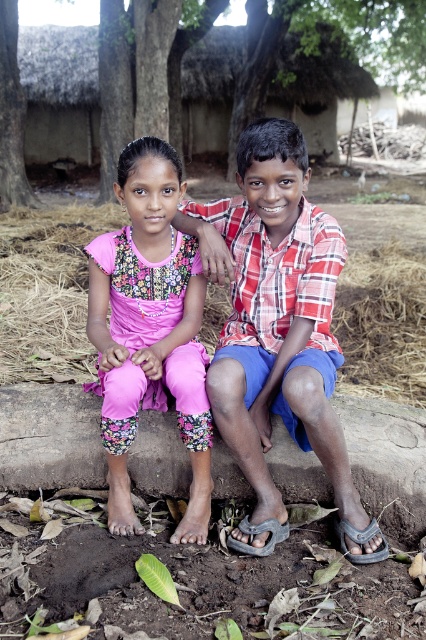
Question: Is red checkered shirt at center to the left of brown rough tree trunk at upper left from the viewer's perspective?

Choices:
 (A) no
 (B) yes

Answer: (A)

Question: Which point is farther from the camera taking this photo?

Choices:
 (A) [x=265, y=349]
 (B) [x=181, y=385]

Answer: (A)

Question: Among these points, which one is farthest from the camera?

Choices:
 (A) (261, 388)
 (B) (11, 51)

Answer: (B)

Question: Which is farther from the floral fabric dress at center?

Choices:
 (A) brown rough tree trunk at upper left
 (B) green leafy tree at upper center

Answer: (B)

Question: Is floral fabric dress at center positioned in front of green leafy tree at upper center?

Choices:
 (A) yes
 (B) no

Answer: (A)

Question: Does red checkered shirt at center have a greater width compared to green leafy tree at upper center?

Choices:
 (A) yes
 (B) no

Answer: (B)